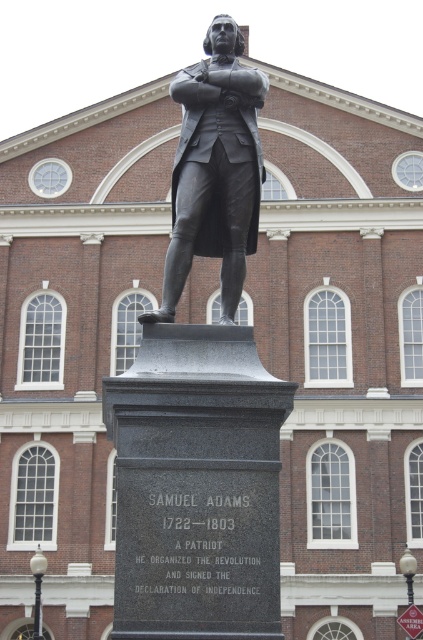
Question: Does polished bronze statue at center have a smaller size compared to bronze statue at center?

Choices:
 (A) no
 (B) yes

Answer: (A)

Question: Is polished bronze statue at center to the right of bronze statue at center from the viewer's perspective?

Choices:
 (A) no
 (B) yes

Answer: (A)

Question: Which point is farther from the camera taking this photo?

Choices:
 (A) (214, 362)
 (B) (206, 97)

Answer: (B)

Question: Observing the image, what is the correct spatial positioning of polished bronze statue at center in reference to bronze statue at center?

Choices:
 (A) right
 (B) left

Answer: (B)